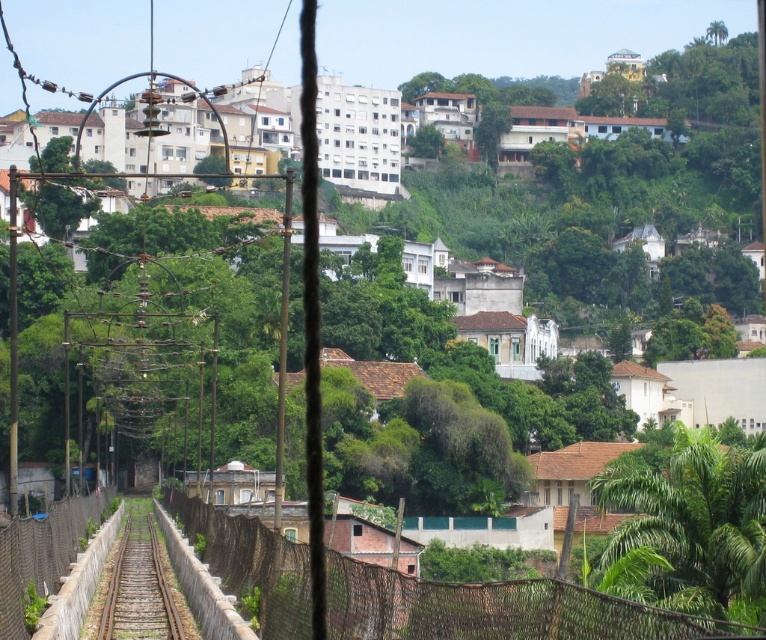
Consider the image. You are a photographer standing at the camera position. You want to take a photo that includes both point (738,563) and point (110,636). Which point is closer to your camera?

Point (110,636) is closer to the camera than point (738,563).

You are a landscape architect designing a new park. You have to decide whether to place a bench between the green leafy tree at lower right and the brown gravel train track at center. Considering their widths, which one is wider and thus requires more space for safety?

The green leafy tree at lower right is wider than the brown gravel train track at center, so it requires more space for safety.